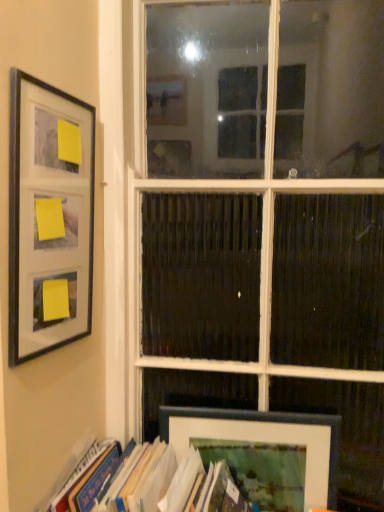
Question: Is matte black frame at lower right, which is the 1th picture frame from back to front, taller than hardcover book at lower left?

Choices:
 (A) yes
 (B) no

Answer: (A)

Question: Is there a large distance between matte black frame at lower right, which is the first picture frame from right to left, and hardcover book at lower left?

Choices:
 (A) yes
 (B) no

Answer: (B)

Question: Can you confirm if matte black frame at lower right, which is the 1th picture frame from back to front, is bigger than hardcover book at lower left?

Choices:
 (A) yes
 (B) no

Answer: (B)

Question: Is matte black frame at lower right, which is counted as the second picture frame, starting from the top, at the left side of hardcover book at lower left?

Choices:
 (A) no
 (B) yes

Answer: (A)

Question: Does matte black frame at lower right, marked as the second picture frame in a left-to-right arrangement, have a greater width compared to hardcover book at lower left?

Choices:
 (A) yes
 (B) no

Answer: (B)

Question: From the image's perspective, is matte black frame at lower right, which is the first picture frame from right to left, below hardcover book at lower left?

Choices:
 (A) no
 (B) yes

Answer: (A)

Question: Considering the relative sizes of hardcover book at lower left and matte black frame at lower right, arranged as the 1th picture frame when ordered from the bottom, in the image provided, is hardcover book at lower left shorter than matte black frame at lower right, arranged as the 1th picture frame when ordered from the bottom,?

Choices:
 (A) no
 (B) yes

Answer: (B)

Question: From the image's perspective, is hardcover book at lower left under matte black frame at lower right, which is the first picture frame from right to left?

Choices:
 (A) no
 (B) yes

Answer: (B)

Question: Could matte black frame at lower right, arranged as the 2th picture frame when viewed from the front, be considered to be inside hardcover book at lower left?

Choices:
 (A) no
 (B) yes

Answer: (A)

Question: Can you confirm if hardcover book at lower left is bigger than matte black frame at lower right, which is the first picture frame from right to left?

Choices:
 (A) no
 (B) yes

Answer: (B)

Question: Does hardcover book at lower left have a smaller size compared to matte black frame at lower right, arranged as the 1th picture frame when ordered from the bottom?

Choices:
 (A) yes
 (B) no

Answer: (B)

Question: Is hardcover book at lower left taller than matte black frame at lower right, which is the 1th picture frame from back to front?

Choices:
 (A) no
 (B) yes

Answer: (A)

Question: From the image's perspective, would you say matte black frame at left, marked as the second picture frame in a right-to-left arrangement, is positioned over hardcover book at lower left?

Choices:
 (A) yes
 (B) no

Answer: (A)